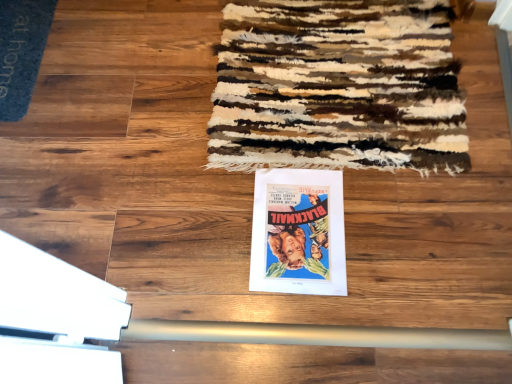
The image size is (512, 384). I want to click on vacant space that is in between blue carpet at upper left and textured woolen mat at upper center, so click(129, 73).